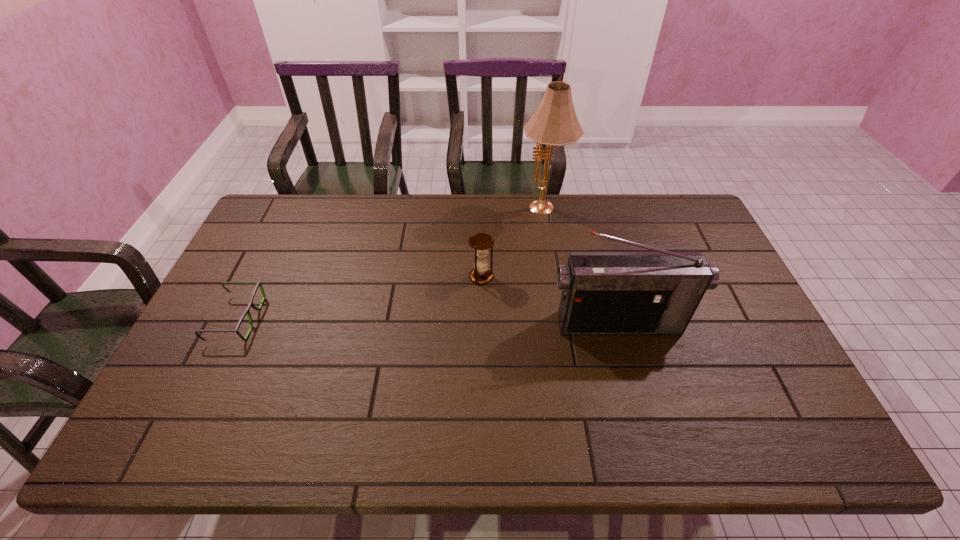
This screenshot has width=960, height=540. What are the coordinates of `the tallest object` in the screenshot? It's located at (554, 123).

The height and width of the screenshot is (540, 960). Find the location of `the farthest object`. the farthest object is located at coordinates (554, 123).

You are a GUI agent. You are given a task and a screenshot of the screen. Output one action in this format:
    pyautogui.click(x=<x>, y=<y>)
    Task: Click on the radio receiver
    Image resolution: width=960 pixels, height=540 pixels.
    Given the screenshot: What is the action you would take?
    pyautogui.click(x=603, y=293)

You are a GUI agent. You are given a task and a screenshot of the screen. Output one action in this format:
    pyautogui.click(x=<x>, y=<y>)
    Task: Click on the third object from right to left
    
    Given the screenshot: What is the action you would take?
    [x=481, y=242]

Find the location of a particular element. The width and height of the screenshot is (960, 540). the third nearest object is located at coordinates (481, 242).

You are a GUI agent. You are given a task and a screenshot of the screen. Output one action in this format:
    pyautogui.click(x=<x>, y=<y>)
    Task: Click on the shortest object
    This screenshot has width=960, height=540.
    Given the screenshot: What is the action you would take?
    pyautogui.click(x=251, y=304)

You are a GUI agent. You are given a task and a screenshot of the screen. Output one action in this format:
    pyautogui.click(x=<x>, y=<y>)
    Task: Click on the spectacles
    The width and height of the screenshot is (960, 540).
    Given the screenshot: What is the action you would take?
    pyautogui.click(x=251, y=304)

The image size is (960, 540). In order to click on free space located 0.360m on the right of the lampshade in this screenshot , I will do `click(670, 210)`.

This screenshot has width=960, height=540. What are the coordinates of `free space located on the front-facing side of the radio receiver` in the screenshot? It's located at (636, 386).

At what (x,y) coordinates should I click in order to perform the action: click on blank space located 0.390m on the right of the second object from left to right. Please return your answer as a coordinate pair (x, y). The image size is (960, 540). Looking at the image, I should click on (621, 276).